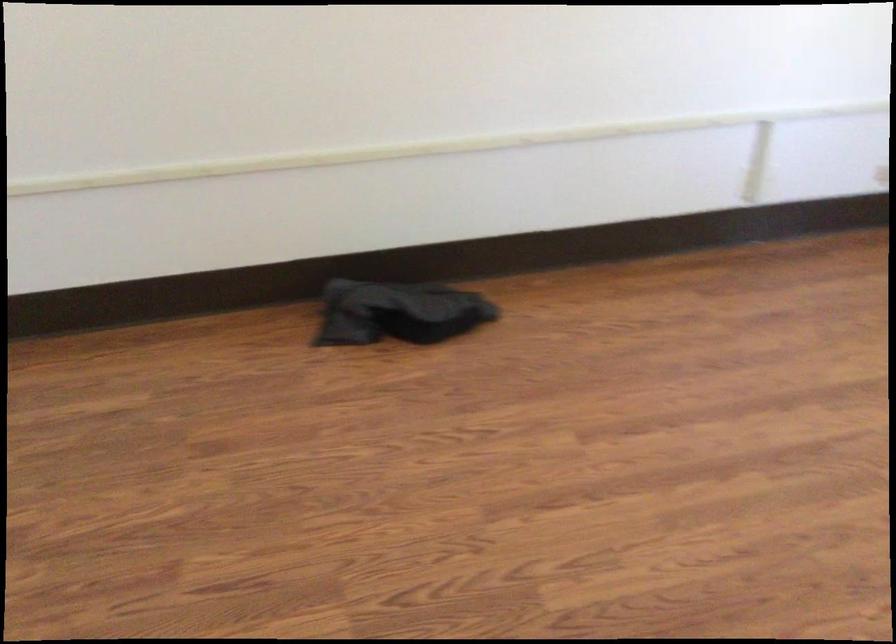
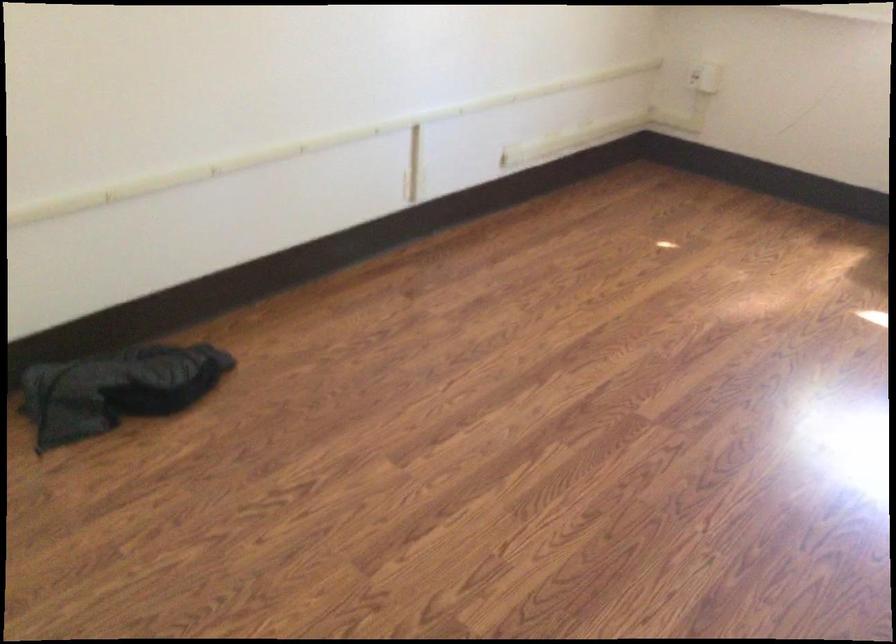
The point at (746, 118) is marked in the first image. Where is the corresponding point in the second image?

(407, 122)